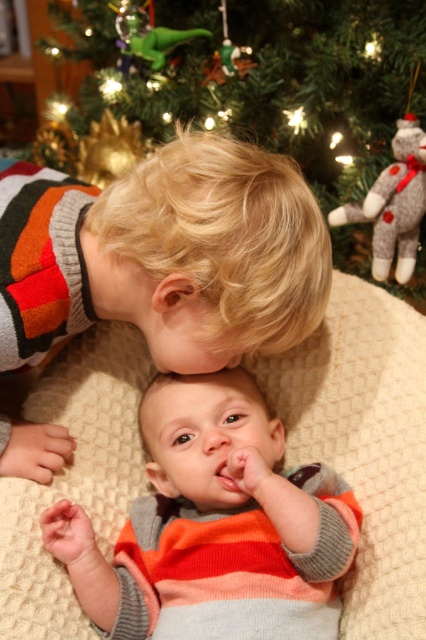
You are a photographer trying to capture a closeup of the striped sweater at center and the striped sweater baby at center. Which one should you focus on first to ensure both are in focus?

You should focus on the striped sweater at center first because it is closer to the viewer than the striped sweater baby at center, so adjusting focus from near to far will help both be in focus.